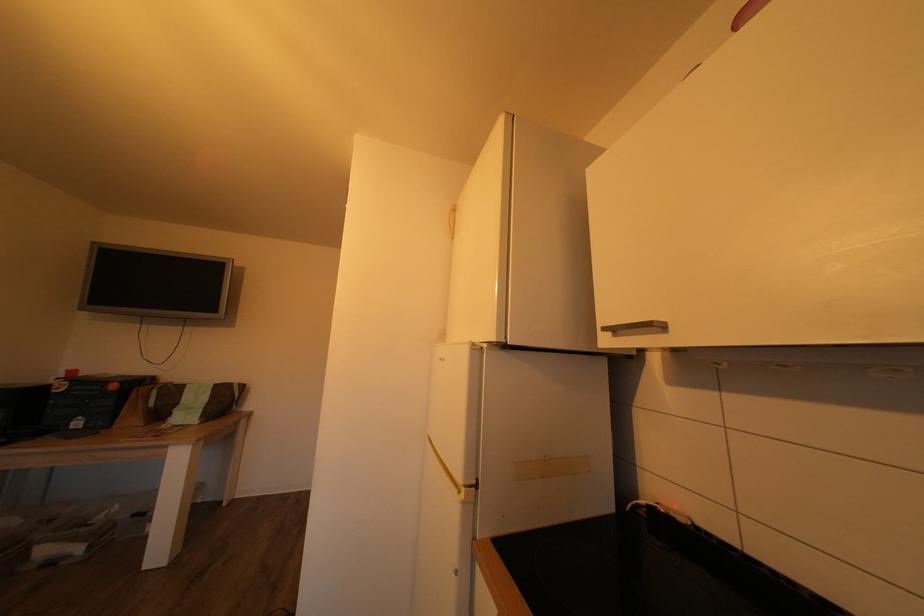
Where would you pull the refrigerator door handle? Please return your answer as a coordinate pair (x, y).

(464, 492)